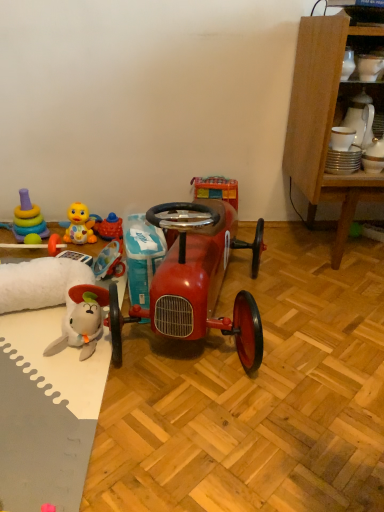
Locate an element on the screen. The height and width of the screenshot is (512, 384). unoccupied region to the right of glossy red model car at center is located at coordinates (317, 313).